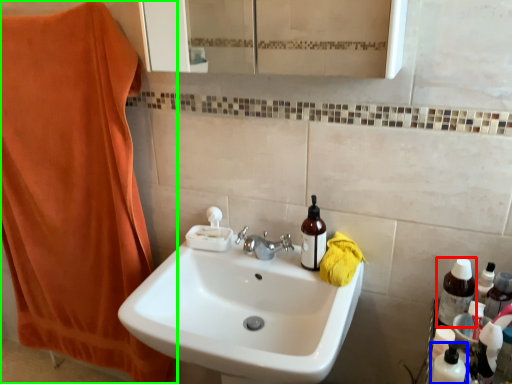
Question: Estimate the real-world distances between objects in this image. Which object is closer to bottle (highlighted by a red box), cleaning product (highlighted by a blue box) or bath towel (highlighted by a green box)?

Choices:
 (A) cleaning product
 (B) bath towel

Answer: (A)